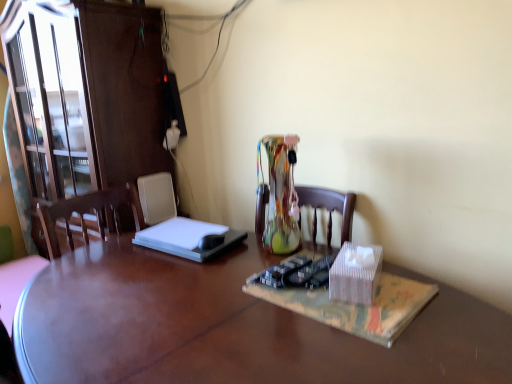
Locate an element on the screen. The height and width of the screenshot is (384, 512). vacant area located to the right-hand side of white cardboard box at center is located at coordinates (433, 290).